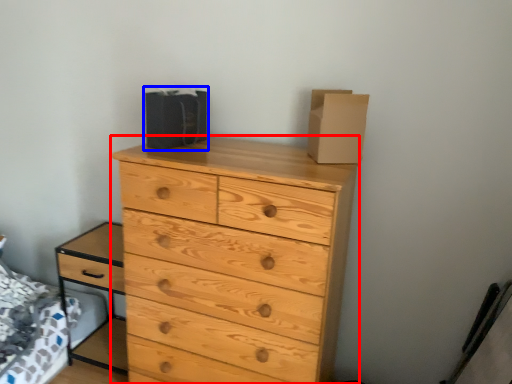
Question: Among these objects, which one is nearest to the camera, chest of drawers (highlighted by a red box) or cardboard box (highlighted by a blue box)?

Choices:
 (A) chest of drawers
 (B) cardboard box

Answer: (A)